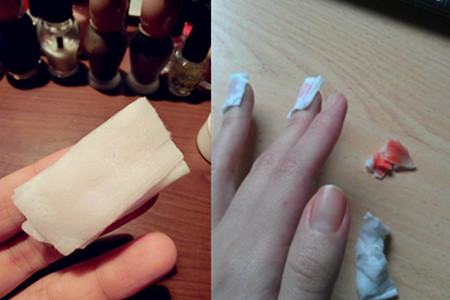
In order to click on wrinkled strip of toilet paper in this screenshot , I will do `click(370, 262)`.